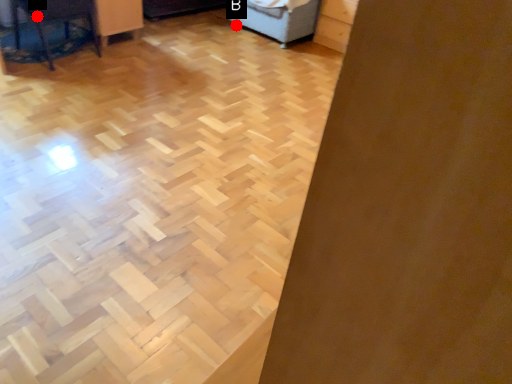
Question: Two points are circled on the image, labeled by A and B beside each circle. Which point appears farthest from the camera in this image?

Choices:
 (A) A is further
 (B) B is further

Answer: (B)